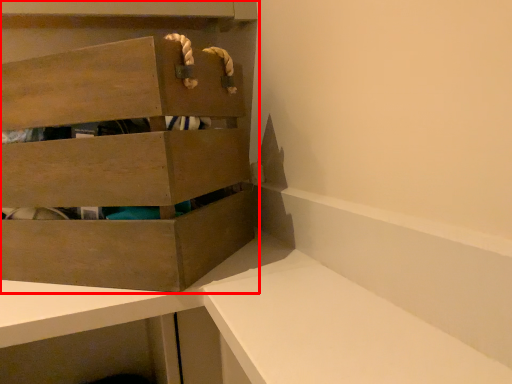
Question: From the image's perspective, considering the relative positions of cabinetry (annotated by the red box) and vanity in the image provided, where is cabinetry (annotated by the red box) located with respect to the staircase?

Choices:
 (A) below
 (B) above

Answer: (B)